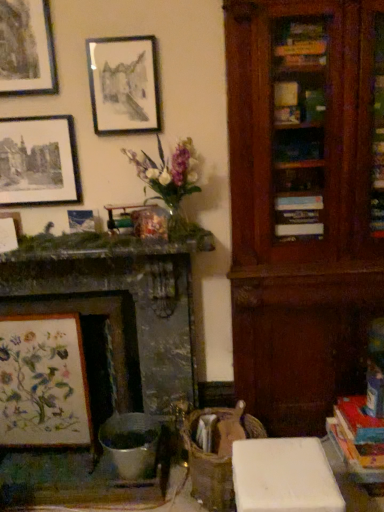
What do you see at coordinates (38, 161) in the screenshot? The image size is (384, 512). I see `matte black picture frame at upper left, the third picture frame viewed from the top` at bounding box center [38, 161].

Describe the element at coordinates (124, 84) in the screenshot. I see `matte black picture frame at upper center, which ranks as the second picture frame in top-to-bottom order` at that location.

Identify the location of matte black picture frame at upper center, which ranks as the second picture frame in top-to-bottom order. The height and width of the screenshot is (512, 384). (124, 84).

The height and width of the screenshot is (512, 384). Describe the element at coordinates (84, 221) in the screenshot. I see `metallic silver picture frame at upper left, the fourth picture frame viewed from the top` at that location.

This screenshot has height=512, width=384. Find the location of `matte black picture frame at upper left, which is counted as the 6th picture frame, starting from the bottom`. matte black picture frame at upper left, which is counted as the 6th picture frame, starting from the bottom is located at coordinates (26, 48).

What do you see at coordinates (14, 221) in the screenshot? I see `matte white picture frame at upper left, which is the second picture frame in bottom-to-top order` at bounding box center [14, 221].

You are a GUI agent. You are given a task and a screenshot of the screen. Output one action in this format:
    pyautogui.click(x=<x>, y=<y>)
    Task: Click on the matte black picture frame at upper left, the 4th picture frame in the bottom-to-top sequence
    The image size is (384, 512).
    Given the screenshot: What is the action you would take?
    pyautogui.click(x=38, y=161)

Can you confirm if embroidered fabric at left, the sixth picture frame viewed from the top, is shorter than matte white picture frame at upper left, which is the second picture frame in bottom-to-top order?

No.

In the scene shown: From the image's perspective, relative to matte white picture frame at upper left, which is the second picture frame in bottom-to-top order, is embroidered fabric at left, the sixth picture frame viewed from the top, above or below?

Based on their image positions, embroidered fabric at left, the sixth picture frame viewed from the top, is located beneath matte white picture frame at upper left, which is the second picture frame in bottom-to-top order.

Is embroidered fabric at left, the sixth picture frame viewed from the top, positioned beyond the bounds of matte white picture frame at upper left, which is the fifth picture frame in top-to-bottom order?

Yes, embroidered fabric at left, the sixth picture frame viewed from the top, is not within matte white picture frame at upper left, which is the fifth picture frame in top-to-bottom order.

From a real-world perspective, which is physically below, embroidered fabric at left, which is counted as the first picture frame, starting from the bottom, or matte white picture frame at upper left, which is the fifth picture frame in top-to-bottom order?

embroidered fabric at left, which is counted as the first picture frame, starting from the bottom.

How much distance is there between matte black picture frame at upper left, marked as the first picture frame in a top-to-bottom arrangement, and hardcover book at lower right?

The distance of matte black picture frame at upper left, marked as the first picture frame in a top-to-bottom arrangement, from hardcover book at lower right is 7.68 feet.

Does matte black picture frame at upper left, which is counted as the 6th picture frame, starting from the bottom, contain hardcover book at lower right?

No, hardcover book at lower right is located outside of matte black picture frame at upper left, which is counted as the 6th picture frame, starting from the bottom.

At what (x,y) coordinates should I click in order to perform the action: click on book on the right of matte black picture frame at upper left, marked as the first picture frame in a top-to-bottom arrangement. Please return your answer as a coordinate pair (x, y). Looking at the image, I should click on (361, 431).

Is matte black picture frame at upper left, which is counted as the 6th picture frame, starting from the bottom, looking in the opposite direction of hardcover book at lower right?

That's not correct — matte black picture frame at upper left, which is counted as the 6th picture frame, starting from the bottom, is not looking away from hardcover book at lower right.

Is matte white picture frame at upper left, which is the fifth picture frame in top-to-bottom order, touching wooden swivel chair at center?

No, matte white picture frame at upper left, which is the fifth picture frame in top-to-bottom order, is not touching wooden swivel chair at center.

Is matte white picture frame at upper left, which is the fifth picture frame in top-to-bottom order, located outside wooden swivel chair at center?

Yes.

The width and height of the screenshot is (384, 512). In order to click on swivel chair on the right side of matte white picture frame at upper left, which is the second picture frame in bottom-to-top order in this screenshot , I will do `click(217, 453)`.

Between matte white picture frame at upper left, which is the second picture frame in bottom-to-top order, and wooden swivel chair at center, which one has more height?

wooden swivel chair at center.

You are a GUI agent. You are given a task and a screenshot of the screen. Output one action in this format:
    pyautogui.click(x=<x>, y=<y>)
    Task: Click on the 1st picture frame to the left of the wooden swivel chair at center, counting from the anchor's position
    This screenshot has width=384, height=512.
    Given the screenshot: What is the action you would take?
    pos(124,84)

Which object is positioned more to the left, wooden swivel chair at center or matte black picture frame at upper center, which ranks as the second picture frame in top-to-bottom order?

matte black picture frame at upper center, which ranks as the second picture frame in top-to-bottom order.

From the picture: Is wooden swivel chair at center touching matte black picture frame at upper center, which is the fifth picture frame in bottom-to-top order?

No, wooden swivel chair at center is not beside matte black picture frame at upper center, which is the fifth picture frame in bottom-to-top order.

From the image's perspective, which one is positioned higher, matte black picture frame at upper left, which is counted as the 6th picture frame, starting from the bottom, or matte white picture frame at upper left, which is the second picture frame in bottom-to-top order?

matte black picture frame at upper left, which is counted as the 6th picture frame, starting from the bottom, is shown above in the image.

Is matte black picture frame at upper left, marked as the first picture frame in a top-to-bottom arrangement, not close to matte white picture frame at upper left, which is the fifth picture frame in top-to-bottom order?

No, matte black picture frame at upper left, marked as the first picture frame in a top-to-bottom arrangement, is in close proximity to matte white picture frame at upper left, which is the fifth picture frame in top-to-bottom order.

From a real-world perspective, is matte black picture frame at upper left, which is counted as the 6th picture frame, starting from the bottom, under matte white picture frame at upper left, which is the fifth picture frame in top-to-bottom order?

No, from a real-world perspective, matte black picture frame at upper left, which is counted as the 6th picture frame, starting from the bottom, is not beneath matte white picture frame at upper left, which is the fifth picture frame in top-to-bottom order.

From the image's perspective, is embroidered fabric at left, which is counted as the first picture frame, starting from the bottom, located beneath matte black picture frame at upper left, marked as the first picture frame in a top-to-bottom arrangement?

Yes, from the image's perspective, embroidered fabric at left, which is counted as the first picture frame, starting from the bottom, is below matte black picture frame at upper left, marked as the first picture frame in a top-to-bottom arrangement.

Which object is more forward, embroidered fabric at left, the sixth picture frame viewed from the top, or matte black picture frame at upper left, which is counted as the 6th picture frame, starting from the bottom?

matte black picture frame at upper left, which is counted as the 6th picture frame, starting from the bottom.

From a real-world perspective, is embroidered fabric at left, the sixth picture frame viewed from the top, beneath matte black picture frame at upper left, which is counted as the 6th picture frame, starting from the bottom?

Yes, from a real-world perspective, embroidered fabric at left, the sixth picture frame viewed from the top, is under matte black picture frame at upper left, which is counted as the 6th picture frame, starting from the bottom.

Can you tell me how much embroidered fabric at left, which is counted as the first picture frame, starting from the bottom, and matte black picture frame at upper left, marked as the first picture frame in a top-to-bottom arrangement, differ in facing direction?

There is a 1.93-degree angle between the facing directions of embroidered fabric at left, which is counted as the first picture frame, starting from the bottom, and matte black picture frame at upper left, marked as the first picture frame in a top-to-bottom arrangement.

Is embroidered fabric at left, which is counted as the first picture frame, starting from the bottom, not close to marble fireplace at left?

They are positioned close to each other.

Could you tell me if embroidered fabric at left, which is counted as the first picture frame, starting from the bottom, is turned towards marble fireplace at left?

Yes, embroidered fabric at left, which is counted as the first picture frame, starting from the bottom, is turned towards marble fireplace at left.

The width and height of the screenshot is (384, 512). Find the location of `fireplace above the embroidered fabric at left, the sixth picture frame viewed from the top (from a real-world perspective)`. fireplace above the embroidered fabric at left, the sixth picture frame viewed from the top (from a real-world perspective) is located at coordinates (119, 306).

From a real-world perspective, is embroidered fabric at left, which is counted as the first picture frame, starting from the bottom, physically located above or below marble fireplace at left?

Clearly, from a real-world perspective, embroidered fabric at left, which is counted as the first picture frame, starting from the bottom, is below marble fireplace at left.

At what (x,y) coordinates should I click in order to perform the action: click on picture frame that is the 1st one above the embroidered fabric at left, which is counted as the first picture frame, starting from the bottom (from a real-world perspective). Please return your answer as a coordinate pair (x, y). This screenshot has height=512, width=384. Looking at the image, I should click on (14, 221).

The image size is (384, 512). What are the coordinates of `picture frame in front of the hardcover book at lower right` in the screenshot? It's located at (26, 48).

When comparing their distances from embroidered fabric at left, which is counted as the first picture frame, starting from the bottom, does matte black picture frame at upper center, which is the fifth picture frame in bottom-to-top order, or matte black picture frame at upper left, the 4th picture frame in the bottom-to-top sequence, seem closer?

Based on the image, matte black picture frame at upper left, the 4th picture frame in the bottom-to-top sequence, appears to be nearer to embroidered fabric at left, which is counted as the first picture frame, starting from the bottom.

Based on their spatial positions, is matte black picture frame at upper left, the third picture frame viewed from the top, or matte white picture frame at upper left, which is the second picture frame in bottom-to-top order, closer to matte black picture frame at upper left, marked as the first picture frame in a top-to-bottom arrangement?

matte black picture frame at upper left, the third picture frame viewed from the top, is positioned closer to the anchor matte black picture frame at upper left, marked as the first picture frame in a top-to-bottom arrangement.

Estimate the real-world distances between objects in this image. Which object is further from wooden swivel chair at center, matte black picture frame at upper center, which ranks as the second picture frame in top-to-bottom order, or hardcover book at lower right?

matte black picture frame at upper center, which ranks as the second picture frame in top-to-bottom order.

Based on their spatial positions, is marble fireplace at left or matte white picture frame at upper left, which is the fifth picture frame in top-to-bottom order, closer to embroidered fabric at left, which is counted as the first picture frame, starting from the bottom?

The object closer to embroidered fabric at left, which is counted as the first picture frame, starting from the bottom, is marble fireplace at left.

When comparing their distances from matte black picture frame at upper left, marked as the first picture frame in a top-to-bottom arrangement, does matte black picture frame at upper center, which is the fifth picture frame in bottom-to-top order, or matte black picture frame at upper left, the third picture frame viewed from the top, seem further?

matte black picture frame at upper left, the third picture frame viewed from the top, is further to matte black picture frame at upper left, marked as the first picture frame in a top-to-bottom arrangement.

Which object lies nearer to the anchor point matte white picture frame at upper left, which is the fifth picture frame in top-to-bottom order, hardcover book at lower right or matte black picture frame at upper left, marked as the first picture frame in a top-to-bottom arrangement?

Based on the image, matte black picture frame at upper left, marked as the first picture frame in a top-to-bottom arrangement, appears to be nearer to matte white picture frame at upper left, which is the fifth picture frame in top-to-bottom order.

When comparing their distances from matte black picture frame at upper left, the 4th picture frame in the bottom-to-top sequence, does matte white picture frame at upper left, which is the fifth picture frame in top-to-bottom order, or hardcover book at lower right seem further?

hardcover book at lower right is positioned further to the anchor matte black picture frame at upper left, the 4th picture frame in the bottom-to-top sequence.

Estimate the real-world distances between objects in this image. Which object is further from embroidered fabric at left, which is counted as the first picture frame, starting from the bottom, hardcover book at lower right or matte black picture frame at upper center, which ranks as the second picture frame in top-to-bottom order?

hardcover book at lower right lies further to embroidered fabric at left, which is counted as the first picture frame, starting from the bottom, than the other object.

The height and width of the screenshot is (512, 384). In order to click on fireplace that lies between matte black picture frame at upper left, which is counted as the 6th picture frame, starting from the bottom, and wooden swivel chair at center from top to bottom in this screenshot , I will do `click(119, 306)`.

This screenshot has height=512, width=384. I want to click on fireplace between matte black picture frame at upper center, which ranks as the second picture frame in top-to-bottom order, and embroidered fabric at left, the sixth picture frame viewed from the top, from top to bottom, so click(x=119, y=306).

Find the location of `swivel chair between matte white picture frame at upper left, which is the second picture frame in bottom-to-top order, and hardcover book at lower right`. swivel chair between matte white picture frame at upper left, which is the second picture frame in bottom-to-top order, and hardcover book at lower right is located at coordinates (217, 453).

The height and width of the screenshot is (512, 384). In order to click on fireplace that lies between matte white picture frame at upper left, which is the fifth picture frame in top-to-bottom order, and embroidered fabric at left, which is counted as the first picture frame, starting from the bottom, from top to bottom in this screenshot , I will do `click(119, 306)`.